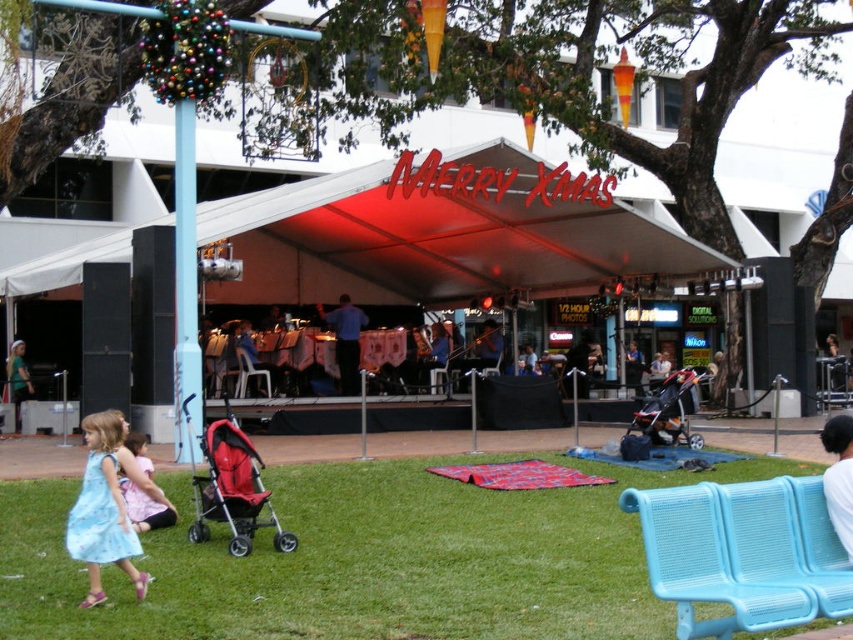
Between light blue satin dress at lower left and white fabric shirt at lower right, which one is positioned lower?

light blue satin dress at lower left is lower down.

Does light blue satin dress at lower left appear on the right side of white fabric shirt at lower right?

No, light blue satin dress at lower left is not to the right of white fabric shirt at lower right.

Is point (131, 540) more distant than point (846, 474)?

Yes.

You are a GUI agent. You are given a task and a screenshot of the screen. Output one action in this format:
    pyautogui.click(x=<x>, y=<y>)
    Task: Click on the light blue satin dress at lower left
    The height and width of the screenshot is (640, 853).
    Given the screenshot: What is the action you would take?
    pyautogui.click(x=102, y=509)

Consider the image. Is green grass at lower center further to the viewer compared to orange fabric stroller at center?

No, it is in front of orange fabric stroller at center.

Can you confirm if green grass at lower center is positioned to the left of orange fabric stroller at center?

Indeed, green grass at lower center is positioned on the left side of orange fabric stroller at center.

Locate an element on the screen. The image size is (853, 640). green grass at lower center is located at coordinates (364, 561).

Does green grass at lower center appear on the left side of white fabric shirt at lower right?

Correct, you'll find green grass at lower center to the left of white fabric shirt at lower right.

Does green grass at lower center have a greater height compared to white fabric shirt at lower right?

Incorrect, green grass at lower center's height is not larger of white fabric shirt at lower right's.

Between point (415, 556) and point (837, 438), which one is positioned in front?

Positioned in front is point (837, 438).

Image resolution: width=853 pixels, height=640 pixels. In order to click on green grass at lower center in this screenshot , I will do coord(364,561).